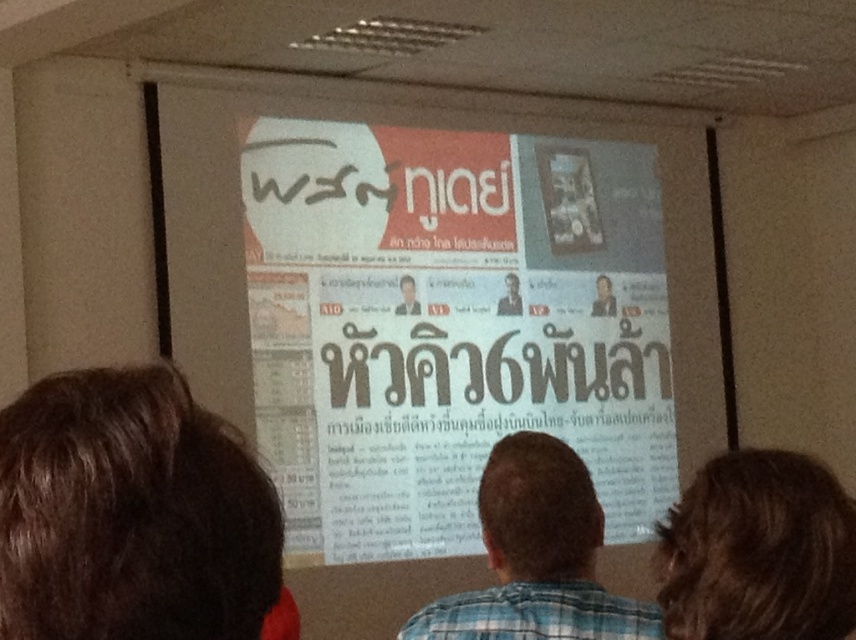
Is white paper poster at center below matte gray face at center?

Indeed, white paper poster at center is positioned under matte gray face at center.

Is point (666, 440) closer to viewer compared to point (408, 289)?

No.

At what (x,y) coordinates should I click in order to perform the action: click on white paper poster at center. Please return your answer as a coordinate pair (x, y). The image size is (856, 640). Looking at the image, I should click on (449, 324).

This screenshot has width=856, height=640. Find the location of `blue plaid shirt at center`. blue plaid shirt at center is located at coordinates (538, 556).

Which is more to the left, blue plaid shirt at center or matte gray face at center?

matte gray face at center is more to the left.

At what (x,y) coordinates should I click in order to perform the action: click on blue plaid shirt at center. Please return your answer as a coordinate pair (x, y). The width and height of the screenshot is (856, 640). Looking at the image, I should click on (538, 556).

What are the coordinates of `blue plaid shirt at center` in the screenshot? It's located at (538, 556).

Is dark brown hair at lower right above matte gray face at center?

No.

Looking at this image, can you confirm if dark brown hair at lower right is smaller than matte gray face at center?

Actually, dark brown hair at lower right might be larger than matte gray face at center.

Image resolution: width=856 pixels, height=640 pixels. Find the location of `dark brown hair at lower right`. dark brown hair at lower right is located at coordinates (758, 552).

Locate an element on the screen. Image resolution: width=856 pixels, height=640 pixels. dark brown hair at lower right is located at coordinates (758, 552).